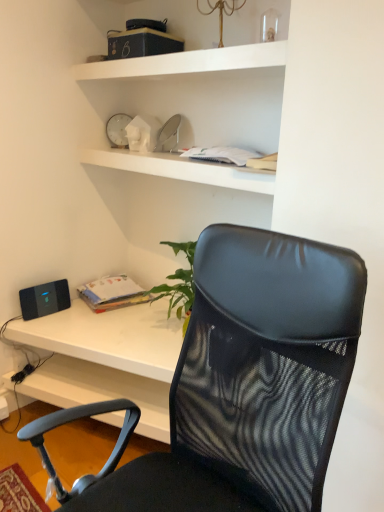
Find the location of a particular element. The height and width of the screenshot is (512, 384). black mesh chair at center is located at coordinates (249, 382).

You are a GUI agent. You are given a task and a screenshot of the screen. Output one action in this format:
    pyautogui.click(x=<x>, y=<y>)
    Task: Click on the white plastic clock at upper center
    The height and width of the screenshot is (512, 384).
    Given the screenshot: What is the action you would take?
    pyautogui.click(x=118, y=130)

What is the approximate height of white plastic clock at upper center?

white plastic clock at upper center is 7.49 inches in height.

At what (x,y) coordinates should I click in order to perform the action: click on black matte speaker at lower left. Please return your answer as a coordinate pair (x, y). Looking at the image, I should click on (44, 298).

In order to face matte paper book at center, should I rotate leftwards or rightwards?

To align with it, rotate left about 10.623°.

Where is `white matte shelf at upper center`? This screenshot has height=512, width=384. white matte shelf at upper center is located at coordinates (186, 62).

Consider the image. From the image's perspective, which object appears higher, black matte speaker at lower left or black mesh chair at center?

black matte speaker at lower left, from the image's perspective.

Is black matte speaker at lower left positioned far away from black mesh chair at center?

Yes, black matte speaker at lower left is far from black mesh chair at center.

Based on the photo, is black matte speaker at lower left thinner than black mesh chair at center?

Correct, the width of black matte speaker at lower left is less than that of black mesh chair at center.

From the picture: From a real-world perspective, between black matte speaker at lower left and black mesh chair at center, who is vertically lower?

In real-world perspective, black matte speaker at lower left is lower.

Can you confirm if white plastic clock at upper center is bigger than black mesh chair at center?

No.

Is white plastic clock at upper center aimed at black mesh chair at center?

No, white plastic clock at upper center is not turned towards black mesh chair at center.

Based on the photo, in terms of width, does white plastic clock at upper center look wider or thinner when compared to black mesh chair at center?

Clearly, white plastic clock at upper center has less width compared to black mesh chair at center.

Considering their positions, is white plastic clock at upper center located in front of or behind black mesh chair at center?

white plastic clock at upper center is behind black mesh chair at center.

Is matte paper book at center a part of white plastic clock at upper center?

Actually, matte paper book at center is outside white plastic clock at upper center.

Considering the relative positions of white plastic clock at upper center and matte paper book at center in the image provided, is white plastic clock at upper center to the left of matte paper book at center from the viewer's perspective?

No.

Looking at this image, from a real-world perspective, is white plastic clock at upper center beneath matte paper book at center?

Incorrect, from a real-world perspective, white plastic clock at upper center is higher than matte paper book at center.

Where is `clock above the black mesh chair at center (from a real-world perspective)`? clock above the black mesh chair at center (from a real-world perspective) is located at coordinates (118, 130).

From the image's perspective, between black mesh chair at center and white plastic clock at upper center, which one is located above?

white plastic clock at upper center appears higher in the image.

Is black mesh chair at center far away from white plastic clock at upper center?

That's right, there is a large distance between black mesh chair at center and white plastic clock at upper center.

From a real-world perspective, does black mesh chair at center stand above white plastic clock at upper center?

Incorrect, from a real-world perspective, black mesh chair at center is lower than white plastic clock at upper center.

Consider the image. From a real-world perspective, is matte paper book at center over black mesh chair at center?

No, from a real-world perspective, matte paper book at center is not over black mesh chair at center

Based on the photo, considering the sizes of objects matte paper book at center and black mesh chair at center in the image provided, who is thinner, matte paper book at center or black mesh chair at center?

matte paper book at center is thinner.

Is matte paper book at center smaller than black mesh chair at center?

Yes, matte paper book at center is smaller than black mesh chair at center.

Which is closer to the camera, (111, 305) or (242, 327)?

Point (111, 305) is farther from the camera than point (242, 327).

What's the angular difference between white matte shelf at upper center and black mesh chair at center's facing directions?

There is a 0.43-degree angle between the facing directions of white matte shelf at upper center and black mesh chair at center.

Between point (155, 71) and point (128, 406), which one is positioned in front?

The point (128, 406) is more forward.

Can you confirm if white matte shelf at upper center is positioned to the right of black mesh chair at center?

Correct, you'll find white matte shelf at upper center to the right of black mesh chair at center.

Considering the sizes of white matte shelf at upper center and black mesh chair at center in the image, is white matte shelf at upper center wider or thinner than black mesh chair at center?

white matte shelf at upper center is thinner than black mesh chair at center.

From the image's perspective, is black matte speaker at lower left located above white matte shelf at upper center?

Actually, black matte speaker at lower left appears below white matte shelf at upper center in the image.

Is black matte speaker at lower left taller or shorter than white matte shelf at upper center?

black matte speaker at lower left is taller than white matte shelf at upper center.

Is black matte speaker at lower left smaller than white matte shelf at upper center?

Indeed, black matte speaker at lower left has a smaller size compared to white matte shelf at upper center.

From a real-world perspective, is black matte speaker at lower left physically located above or below white matte shelf at upper center?

Clearly, from a real-world perspective, black matte speaker at lower left is below white matte shelf at upper center.

Where is `chair below the black matte speaker at lower left (from the image's perspective)`? Image resolution: width=384 pixels, height=512 pixels. chair below the black matte speaker at lower left (from the image's perspective) is located at coordinates (249, 382).

Find the location of a particular element. clock above the black mesh chair at center (from a real-world perspective) is located at coordinates (118, 130).

Looking at the image, which one is located further to black mesh chair at center, black matte speaker at lower left or white matte shelf at upper center?

black matte speaker at lower left is further to black mesh chair at center.

Based on their spatial positions, is white plastic clock at upper center or white matte shelf at upper center closer to black mesh chair at center?

white matte shelf at upper center.

From the image, which object appears to be farther from matte paper book at center, black mesh chair at center or white matte shelf at upper center?

Among the two, black mesh chair at center is located further to matte paper book at center.

Considering their positions, is black mesh chair at center positioned closer to black matte speaker at lower left than white matte shelf at upper center?

Based on the image, white matte shelf at upper center appears to be nearer to black matte speaker at lower left.

Looking at the image, which one is located closer to matte paper book at center, white plastic clock at upper center or white matte shelf at upper center?

The object closer to matte paper book at center is white plastic clock at upper center.

Based on their spatial positions, is black mesh chair at center or white plastic clock at upper center closer to matte paper book at center?

Based on the image, white plastic clock at upper center appears to be nearer to matte paper book at center.

Looking at the image, which one is located further to white matte shelf at upper center, black mesh chair at center or black matte speaker at lower left?

black matte speaker at lower left is positioned further to the anchor white matte shelf at upper center.

Consider the image. Looking at the image, which one is located closer to white matte shelf at upper center, black mesh chair at center or matte paper book at center?

Among the two, black mesh chair at center is located nearer to white matte shelf at upper center.

At what (x,y) coordinates should I click in order to perform the action: click on shelf located between black mesh chair at center and black matte speaker at lower left in the depth direction. Please return your answer as a coordinate pair (x, y). Looking at the image, I should click on (186, 62).

The width and height of the screenshot is (384, 512). What are the coordinates of `shelf between black mesh chair at center and white plastic clock at upper center in the front-back direction` in the screenshot? It's located at (186, 62).

Where is `clock between white matte shelf at upper center and matte paper book at center vertically`? This screenshot has width=384, height=512. clock between white matte shelf at upper center and matte paper book at center vertically is located at coordinates (118, 130).

Find the location of a particular element. This screenshot has width=384, height=512. clock between white matte shelf at upper center and black matte speaker at lower left in the vertical direction is located at coordinates (118, 130).